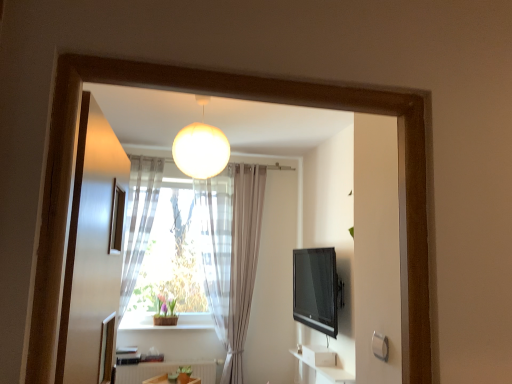
Question: From the image's perspective, is black glossy tv at right on top of translucent fabric curtain at center, which is counted as the first curtain, starting from the left?

Choices:
 (A) no
 (B) yes

Answer: (A)

Question: Considering the relative sizes of black glossy tv at right and translucent fabric curtain at center, which is counted as the first curtain, starting from the left, in the image provided, is black glossy tv at right bigger than translucent fabric curtain at center, which is counted as the first curtain, starting from the left,?

Choices:
 (A) yes
 (B) no

Answer: (B)

Question: Is the depth of black glossy tv at right less than that of translucent fabric curtain at center, the second curtain in the right-to-left sequence?

Choices:
 (A) no
 (B) yes

Answer: (B)

Question: Is black glossy tv at right oriented towards translucent fabric curtain at center, the second curtain in the right-to-left sequence?

Choices:
 (A) no
 (B) yes

Answer: (B)

Question: Is black glossy tv at right further to the viewer compared to translucent fabric curtain at center, the second curtain in the right-to-left sequence?

Choices:
 (A) no
 (B) yes

Answer: (A)

Question: From a real-world perspective, is black glossy tv at right beneath translucent fabric curtain at center, the second curtain in the right-to-left sequence?

Choices:
 (A) no
 (B) yes

Answer: (B)

Question: Is the position of black glossy tv at right less distant than that of white matte radiator at lower center?

Choices:
 (A) yes
 (B) no

Answer: (A)

Question: Considering the relative sizes of black glossy tv at right and white matte radiator at lower center in the image provided, is black glossy tv at right smaller than white matte radiator at lower center?

Choices:
 (A) yes
 (B) no

Answer: (B)

Question: Does black glossy tv at right appear on the left side of white matte radiator at lower center?

Choices:
 (A) yes
 (B) no

Answer: (B)

Question: Is black glossy tv at right taller than white matte radiator at lower center?

Choices:
 (A) yes
 (B) no

Answer: (A)

Question: Does black glossy tv at right lie behind white matte radiator at lower center?

Choices:
 (A) no
 (B) yes

Answer: (A)

Question: Is white matte radiator at lower center located within black glossy tv at right?

Choices:
 (A) yes
 (B) no

Answer: (B)

Question: Can you confirm if matte glass globe at upper center is wider than white matte radiator at lower center?

Choices:
 (A) yes
 (B) no

Answer: (A)